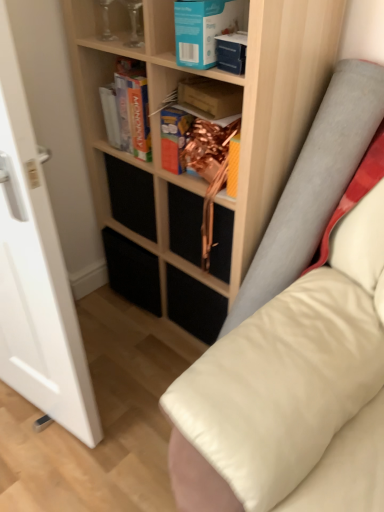
Image resolution: width=384 pixels, height=512 pixels. Describe the element at coordinates (203, 29) in the screenshot. I see `blue cardboard book at upper center, the first paperback book viewed from the front` at that location.

The height and width of the screenshot is (512, 384). What do you see at coordinates (36, 272) in the screenshot? I see `transparent glass door at left` at bounding box center [36, 272].

Describe the element at coordinates (112, 22) in the screenshot. I see `clear glass vase at upper left, the 2th shelf from the right` at that location.

This screenshot has width=384, height=512. Identify the location of matte cardboard box at upper center, marked as the second paperback book in a back-to-front arrangement. (210, 97).

Image resolution: width=384 pixels, height=512 pixels. What do you see at coordinates (210, 97) in the screenshot?
I see `matte cardboard box at upper center, marked as the second paperback book in a back-to-front arrangement` at bounding box center [210, 97].

Identify the location of wooden shelf at center, the first shelf in the right-to-left sequence. (197, 176).

Between transparent glass door at left and matte cardboard book at center, which is the 1th paperback book from back to front, which one has smaller width?

matte cardboard book at center, which is the 1th paperback book from back to front.

Do you think transparent glass door at left is within matte cardboard book at center, which ranks as the third paperback book in front-to-back order, or outside of it?

transparent glass door at left is outside matte cardboard book at center, which ranks as the third paperback book in front-to-back order.

From the image's perspective, which one is positioned higher, transparent glass door at left or matte cardboard book at center, which ranks as the third paperback book in front-to-back order?

matte cardboard book at center, which ranks as the third paperback book in front-to-back order.

Is blue cardboard book at upper center, the first paperback book viewed from the front, oriented away from wooden shelf at center, the first shelf in the right-to-left sequence?

Yes, blue cardboard book at upper center, the first paperback book viewed from the front,'s orientation is away from wooden shelf at center, the first shelf in the right-to-left sequence.

From the image's perspective, is blue cardboard book at upper center, the 3th paperback book positioned from the back, positioned above or below wooden shelf at center, the first shelf in the right-to-left sequence?

blue cardboard book at upper center, the 3th paperback book positioned from the back, is above wooden shelf at center, the first shelf in the right-to-left sequence.

Based on the photo, can you tell me how much blue cardboard book at upper center, the 3th paperback book positioned from the back, and wooden shelf at center, the first shelf in the right-to-left sequence, differ in facing direction?

blue cardboard book at upper center, the 3th paperback book positioned from the back, and wooden shelf at center, the first shelf in the right-to-left sequence, are facing 6.31 degrees away from each other.

Which of these two, blue cardboard book at upper center, the first paperback book viewed from the front, or wooden shelf at center, the first shelf in the right-to-left sequence, is wider?

Wider between the two is wooden shelf at center, the first shelf in the right-to-left sequence.

In the scene shown: What's the angular difference between clear glass vase at upper left, positioned as the first shelf in left-to-right order, and matte cardboard book at center, which ranks as the third paperback book in front-to-back order,'s facing directions?

0.00171 degrees.

Is matte cardboard book at center, which ranks as the third paperback book in front-to-back order, surrounded by clear glass vase at upper left, the 2th shelf from the right?

Definitely not — matte cardboard book at center, which ranks as the third paperback book in front-to-back order, is not inside clear glass vase at upper left, the 2th shelf from the right.

From the image's perspective, between clear glass vase at upper left, the 2th shelf from the right, and matte cardboard book at center, which ranks as the third paperback book in front-to-back order, who is located below?

matte cardboard book at center, which ranks as the third paperback book in front-to-back order, from the image's perspective.

Is clear glass vase at upper left, the 2th shelf from the right, positioned with its back to matte cardboard book at center, which ranks as the third paperback book in front-to-back order?

No, clear glass vase at upper left, the 2th shelf from the right, is not facing away from matte cardboard book at center, which ranks as the third paperback book in front-to-back order.

Is clear glass vase at upper left, positioned as the first shelf in left-to-right order, positioned beyond the bounds of blue cardboard book at upper center, the 3th paperback book positioned from the back?

clear glass vase at upper left, positioned as the first shelf in left-to-right order, lies outside blue cardboard book at upper center, the 3th paperback book positioned from the back,'s area.

What's the angular difference between clear glass vase at upper left, the 2th shelf from the right, and blue cardboard book at upper center, the 3th paperback book positioned from the back,'s facing directions?

5.8 degrees.

Is point (114, 9) more distant than point (191, 4)?

Yes, point (114, 9) is farther from viewer.

From the image's perspective, is clear glass vase at upper left, positioned as the first shelf in left-to-right order, positioned above or below blue cardboard book at upper center, the first paperback book viewed from the front?

Clearly, from the image's perspective, clear glass vase at upper left, positioned as the first shelf in left-to-right order, is above blue cardboard book at upper center, the first paperback book viewed from the front.

From the image's perspective, is transparent glass door at left above or below matte cardboard box at upper center, marked as the second paperback book in a back-to-front arrangement?

Clearly, from the image's perspective, transparent glass door at left is below matte cardboard box at upper center, marked as the second paperback book in a back-to-front arrangement.

Which object is wider, transparent glass door at left or matte cardboard box at upper center, the second paperback book when ordered from front to back?

Wider between the two is transparent glass door at left.

Is transparent glass door at left touching matte cardboard box at upper center, the second paperback book when ordered from front to back?

No, transparent glass door at left is not making contact with matte cardboard box at upper center, the second paperback book when ordered from front to back.

Is point (70, 332) positioned behind point (238, 102)?

That is False.

From the image's perspective, would you say blue cardboard book at upper center, the 3th paperback book positioned from the back, is shown under clear glass vase at upper left, the 2th shelf from the right?

Indeed, from the image's perspective, blue cardboard book at upper center, the 3th paperback book positioned from the back, is shown beneath clear glass vase at upper left, the 2th shelf from the right.

Is blue cardboard book at upper center, the 3th paperback book positioned from the back, closer to camera compared to clear glass vase at upper left, positioned as the first shelf in left-to-right order?

That is True.

Is blue cardboard book at upper center, the first paperback book viewed from the front, oriented towards clear glass vase at upper left, positioned as the first shelf in left-to-right order?

No, blue cardboard book at upper center, the first paperback book viewed from the front, is not oriented towards clear glass vase at upper left, positioned as the first shelf in left-to-right order.

Based on their sizes in the image, would you say black matte drawer at lower center is bigger or smaller than matte cardboard book at center, which ranks as the third paperback book in front-to-back order?

Considering their sizes, black matte drawer at lower center takes up more space than matte cardboard book at center, which ranks as the third paperback book in front-to-back order.

From a real-world perspective, between black matte drawer at lower center and matte cardboard book at center, which is the 1th paperback book from back to front, who is vertically lower?

In real-world perspective, black matte drawer at lower center is lower.

Where is `drawer lying below the matte cardboard book at center, which is the 1th paperback book from back to front (from the image's perspective)`? Image resolution: width=384 pixels, height=512 pixels. drawer lying below the matte cardboard book at center, which is the 1th paperback book from back to front (from the image's perspective) is located at coordinates (132, 271).

Can you see black matte drawer at lower center touching matte cardboard book at center, which is the 1th paperback book from back to front?

No, black matte drawer at lower center is not making contact with matte cardboard book at center, which is the 1th paperback book from back to front.

You are a GUI agent. You are given a task and a screenshot of the screen. Output one action in this format:
    pyautogui.click(x=<x>, y=<y>)
    Task: Click on the glass door lying in front of the matte cardboard book at center, which is the 1th paperback book from back to front
    
    Given the screenshot: What is the action you would take?
    pos(36,272)

Image resolution: width=384 pixels, height=512 pixels. What are the coordinates of `the 1st shelf to the left of the blue cardboard book at upper center, the first paperback book viewed from the front, counting from the anchor's position` in the screenshot? It's located at (197, 176).

Considering their positions, is black matte drawer at lower center positioned further to blue cardboard book at upper center, the first paperback book viewed from the front, than transparent glass door at left?

Based on the image, black matte drawer at lower center appears to be further to blue cardboard book at upper center, the first paperback book viewed from the front.

From the image, which object appears to be farther from black matte drawer at lower center, matte cardboard book at center, which ranks as the third paperback book in front-to-back order, or matte cardboard box at upper center, marked as the second paperback book in a back-to-front arrangement?

Among the two, matte cardboard box at upper center, marked as the second paperback book in a back-to-front arrangement, is located further to black matte drawer at lower center.

Estimate the real-world distances between objects in this image. Which object is further from matte cardboard box at upper center, marked as the second paperback book in a back-to-front arrangement, clear glass vase at upper left, positioned as the first shelf in left-to-right order, or transparent glass door at left?

transparent glass door at left is further to matte cardboard box at upper center, marked as the second paperback book in a back-to-front arrangement.

Estimate the real-world distances between objects in this image. Which object is closer to blue cardboard book at upper center, the 3th paperback book positioned from the back, matte cardboard box at upper center, marked as the second paperback book in a back-to-front arrangement, or wooden shelf at center, the 2th shelf from the left?

Among the two, matte cardboard box at upper center, marked as the second paperback book in a back-to-front arrangement, is located nearer to blue cardboard book at upper center, the 3th paperback book positioned from the back.

From the image, which object appears to be farther from clear glass vase at upper left, the 2th shelf from the right, black matte drawer at lower center or matte cardboard book at center, which ranks as the third paperback book in front-to-back order?

black matte drawer at lower center lies further to clear glass vase at upper left, the 2th shelf from the right, than the other object.

When comparing their distances from wooden shelf at center, the first shelf in the right-to-left sequence, does transparent glass door at left or matte cardboard box at upper center, marked as the second paperback book in a back-to-front arrangement, seem closer?

matte cardboard box at upper center, marked as the second paperback book in a back-to-front arrangement, is closer to wooden shelf at center, the first shelf in the right-to-left sequence.

Considering their positions, is transparent glass door at left positioned further to blue cardboard book at upper center, the 3th paperback book positioned from the back, than wooden shelf at center, the first shelf in the right-to-left sequence?

transparent glass door at left is further to blue cardboard book at upper center, the 3th paperback book positioned from the back.

Which object lies nearer to the anchor point blue cardboard book at upper center, the first paperback book viewed from the front, wooden shelf at center, the 2th shelf from the left, or black matte drawer at lower center?

wooden shelf at center, the 2th shelf from the left, is closer to blue cardboard book at upper center, the first paperback book viewed from the front.

In order to click on paperback book between matte cardboard box at upper center, the second paperback book when ordered from front to back, and black matte drawer at lower center in the up-down direction in this screenshot , I will do `click(174, 138)`.

I want to click on shelf between clear glass vase at upper left, the 2th shelf from the right, and black matte drawer at lower center, in the vertical direction, so click(197, 176).

I want to click on paperback book located between transparent glass door at left and blue cardboard book at upper center, the first paperback book viewed from the front, in the left-right direction, so click(x=174, y=138).

At what (x,y) coordinates should I click in order to perform the action: click on paperback book located between blue cardboard book at upper center, the first paperback book viewed from the front, and matte cardboard book at center, which is the 1th paperback book from back to front, in the depth direction. Please return your answer as a coordinate pair (x, y). Image resolution: width=384 pixels, height=512 pixels. Looking at the image, I should click on (210, 97).